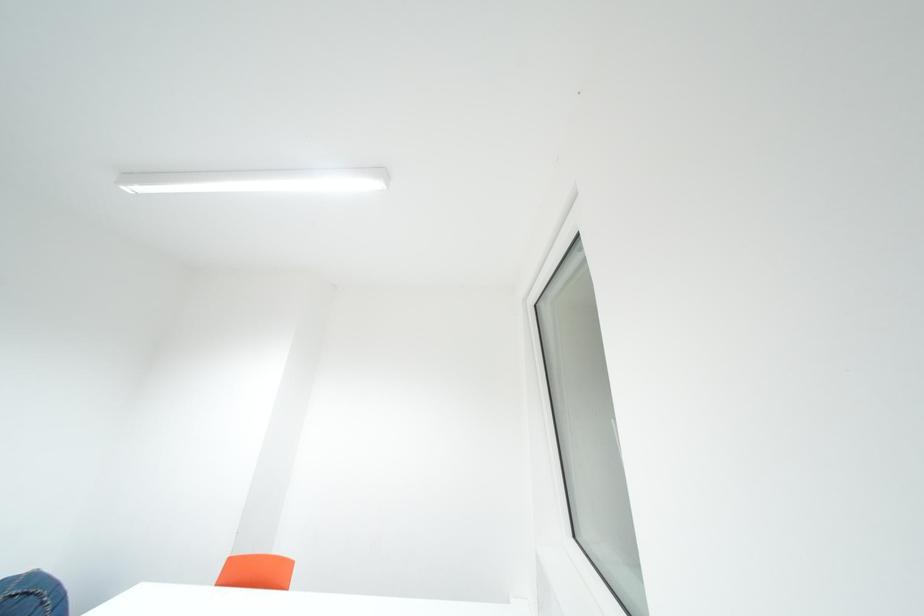
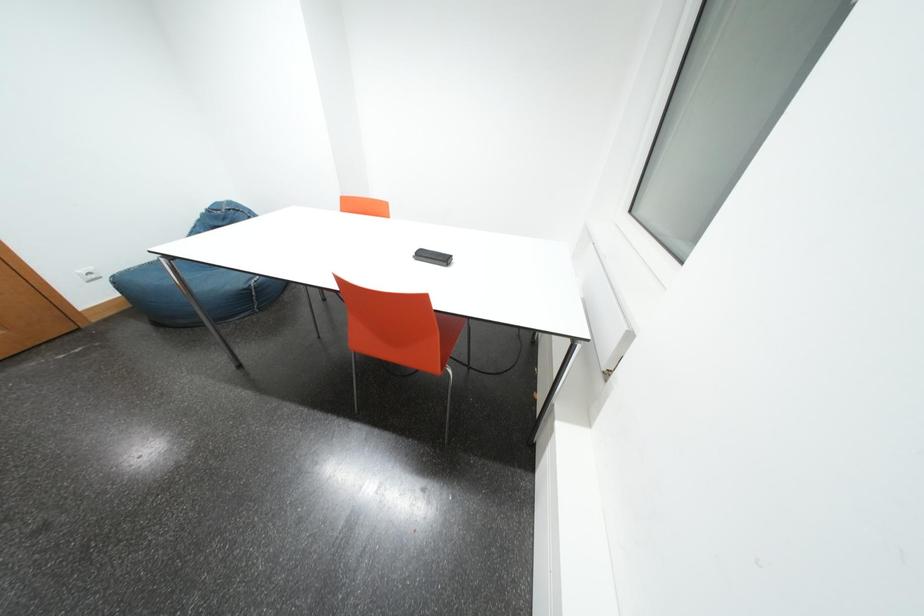
First-person continuous shooting, in which direction is the camera rotating?

The camera rotated toward left-down.